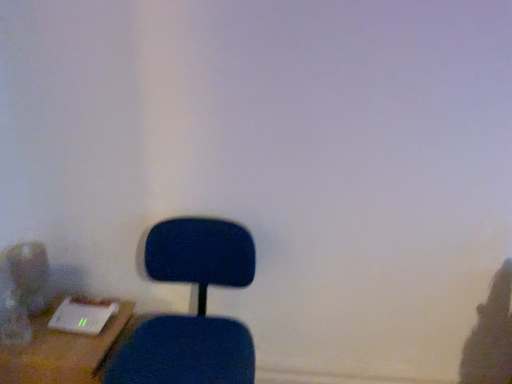
Identify the location of blank space above wooden desk at lower left (from a real-world perspective). This screenshot has height=384, width=512. (70, 316).